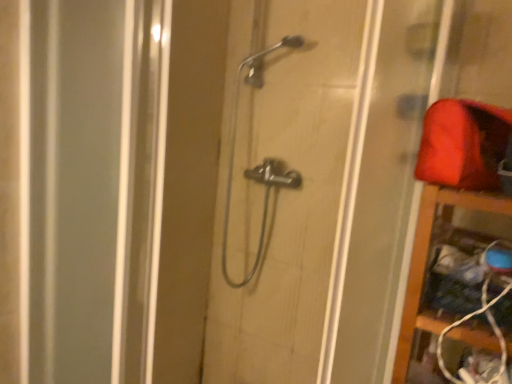
Question: Is polished chrome shower at center to the right of matte red fabric at upper right from the viewer's perspective?

Choices:
 (A) no
 (B) yes

Answer: (A)

Question: Is polished chrome shower at center thinner than matte red fabric at upper right?

Choices:
 (A) yes
 (B) no

Answer: (A)

Question: Is polished chrome shower at center positioned with its back to matte red fabric at upper right?

Choices:
 (A) yes
 (B) no

Answer: (B)

Question: Does polished chrome shower at center have a smaller size compared to matte red fabric at upper right?

Choices:
 (A) yes
 (B) no

Answer: (B)

Question: Can you confirm if polished chrome shower at center is shorter than matte red fabric at upper right?

Choices:
 (A) no
 (B) yes

Answer: (A)

Question: From a real-world perspective, is polished chrome shower at center over matte red fabric at upper right?

Choices:
 (A) no
 (B) yes

Answer: (A)

Question: Is polished chrome shower at center oriented towards metallic showerhead at center?

Choices:
 (A) no
 (B) yes

Answer: (B)

Question: From a real-world perspective, is polished chrome shower at center positioned under metallic showerhead at center based on gravity?

Choices:
 (A) yes
 (B) no

Answer: (B)

Question: Is polished chrome shower at center to the left of metallic showerhead at center from the viewer's perspective?

Choices:
 (A) yes
 (B) no

Answer: (B)

Question: From a real-world perspective, is polished chrome shower at center on metallic showerhead at center?

Choices:
 (A) yes
 (B) no

Answer: (A)

Question: Does polished chrome shower at center have a greater width compared to metallic showerhead at center?

Choices:
 (A) yes
 (B) no

Answer: (B)

Question: Is polished chrome shower at center directly adjacent to metallic showerhead at center?

Choices:
 (A) no
 (B) yes

Answer: (A)

Question: Can you confirm if wooden shelf at right is smaller than metallic showerhead at center?

Choices:
 (A) yes
 (B) no

Answer: (A)